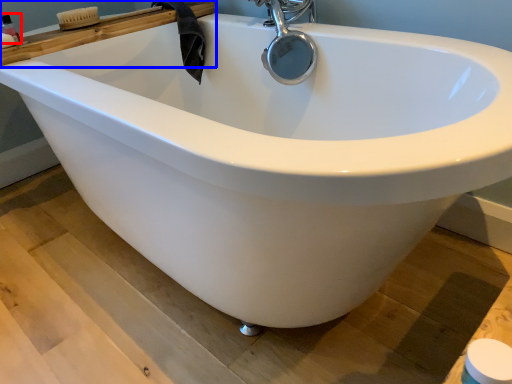
Question: Which of the following is the closest to the observer, toiletry (highlighted by a red box) or ledge (highlighted by a blue box)?

Choices:
 (A) toiletry
 (B) ledge

Answer: (B)